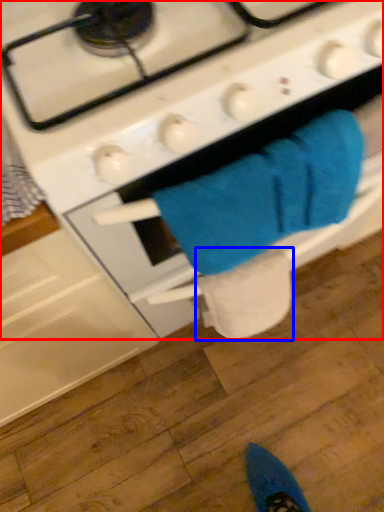
Question: Which object is closer to the camera taking this photo, gas stove (highlighted by a red box) or toilet paper (highlighted by a blue box)?

Choices:
 (A) gas stove
 (B) toilet paper

Answer: (A)